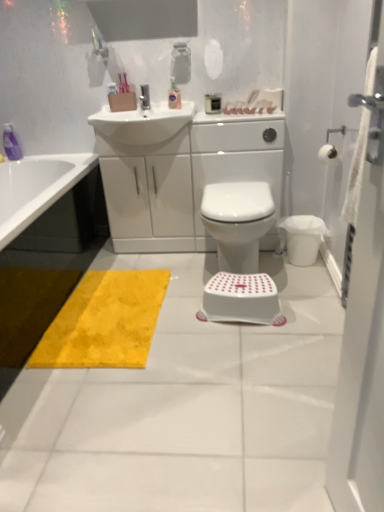
At what (x,y) coordinates should I click in order to perform the action: click on vacant point above yellow fuzzy rug at lower left (from a real-world perspective). Please return your answer as a coordinate pair (x, y). Image resolution: width=384 pixels, height=512 pixels. Looking at the image, I should click on (115, 307).